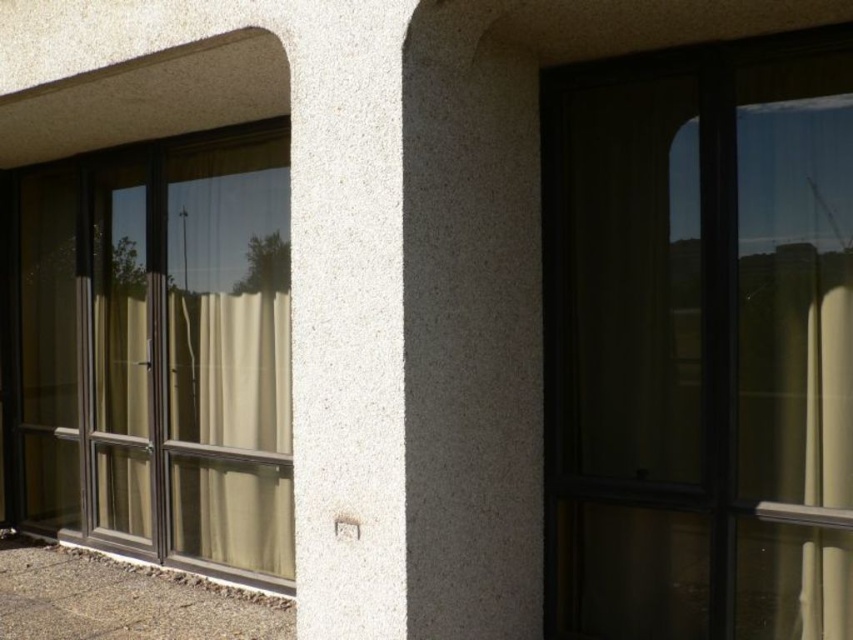
Does transparent glass window at right appear on the right side of transparent glass screen door at left?

Indeed, transparent glass window at right is positioned on the right side of transparent glass screen door at left.

Is transparent glass window at right to the left of transparent glass screen door at left from the viewer's perspective?

No, transparent glass window at right is not to the left of transparent glass screen door at left.

This screenshot has width=853, height=640. What do you see at coordinates (699, 342) in the screenshot?
I see `transparent glass window at right` at bounding box center [699, 342].

Identify the location of transparent glass window at right. (699, 342).